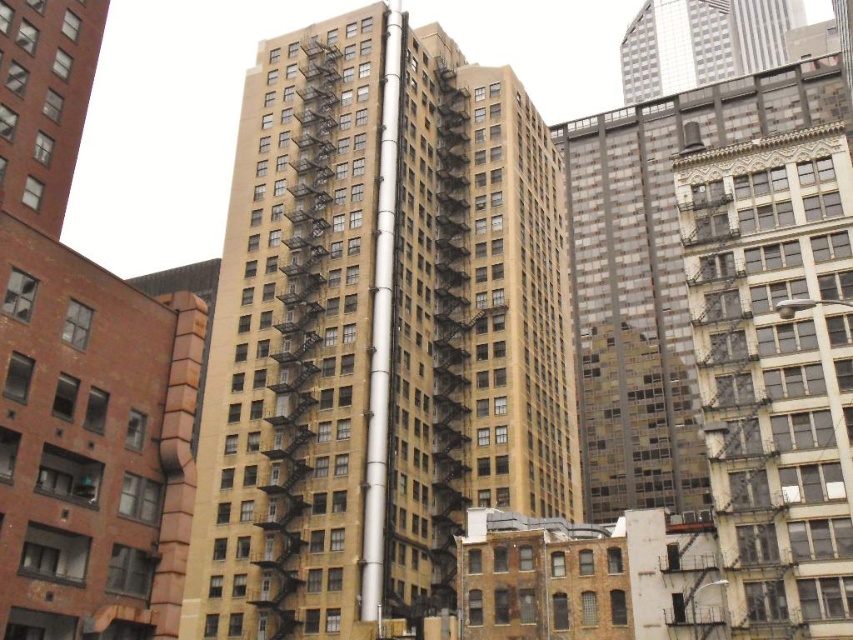
Question: Which is farther from the silver metallic pole at center?

Choices:
 (A) beige concrete building at center
 (B) silver metallic skyscraper at upper right

Answer: (B)

Question: Where is beige concrete building at center located in relation to silver metallic skyscraper at upper right in the image?

Choices:
 (A) left
 (B) right

Answer: (A)

Question: Which point is closer to the camera taking this photo?

Choices:
 (A) (448, 72)
 (B) (654, 90)

Answer: (A)

Question: Is beige concrete building at center thinner than silver metallic pole at center?

Choices:
 (A) no
 (B) yes

Answer: (A)

Question: Is beige concrete building at center behind silver metallic skyscraper at upper right?

Choices:
 (A) no
 (B) yes

Answer: (A)

Question: Estimate the real-world distances between objects in this image. Which object is closer to the beige concrete building at center?

Choices:
 (A) silver metallic pole at center
 (B) silver metallic skyscraper at upper right

Answer: (A)